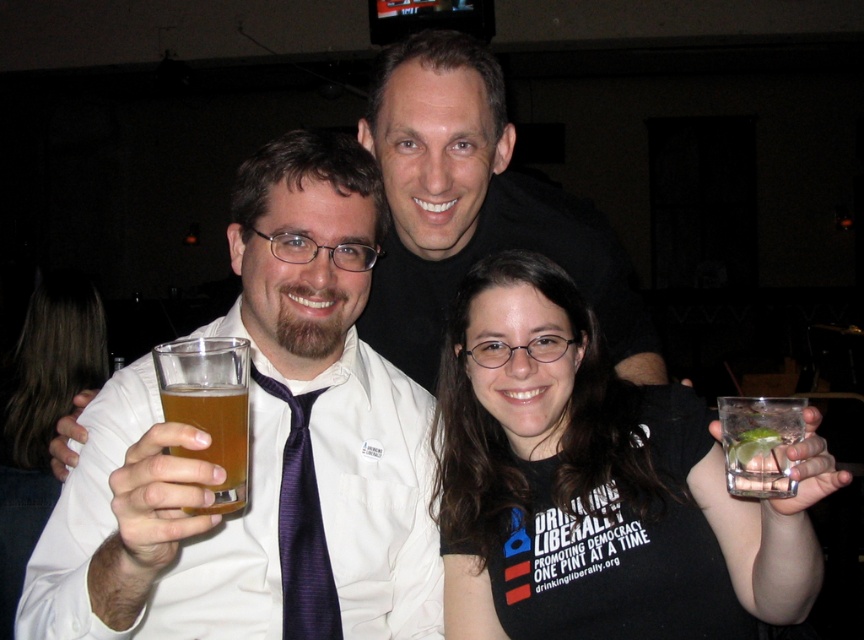
Does purple silk tie at center appear over clear glass at lower right?

No, purple silk tie at center is not above clear glass at lower right.

Is purple silk tie at center closer to the viewer compared to clear glass at lower right?

No, purple silk tie at center is behind clear glass at lower right.

Image resolution: width=864 pixels, height=640 pixels. What do you see at coordinates (302, 528) in the screenshot?
I see `purple silk tie at center` at bounding box center [302, 528].

Where is `purple silk tie at center`? The height and width of the screenshot is (640, 864). purple silk tie at center is located at coordinates (302, 528).

Can you confirm if matte white shirt at center is thinner than purple silk tie at center?

In fact, matte white shirt at center might be wider than purple silk tie at center.

Can you confirm if matte white shirt at center is positioned to the right of purple silk tie at center?

No, matte white shirt at center is not to the right of purple silk tie at center.

Who is more distant from viewer, (75, 472) or (295, 449)?

The point (295, 449) is behind.

Locate an element on the screen. This screenshot has width=864, height=640. matte white shirt at center is located at coordinates (261, 449).

Between black matte t-shirt at center and black matte shirt at center, which one is positioned higher?

black matte t-shirt at center is above.

Is the position of black matte t-shirt at center less distant than that of black matte shirt at center?

Yes.

The width and height of the screenshot is (864, 640). What are the coordinates of `black matte t-shirt at center` in the screenshot? It's located at (595, 484).